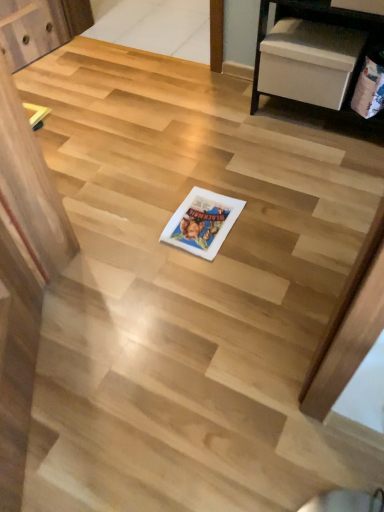
You are a GUI agent. You are given a task and a screenshot of the screen. Output one action in this format:
    pyautogui.click(x=<x>, y=<y>)
    Task: Click on the free location to the left of matte paper comic book at right, the 1th comic book in the right-to-left sequence
    The height and width of the screenshot is (512, 384).
    Given the screenshot: What is the action you would take?
    pyautogui.click(x=337, y=131)